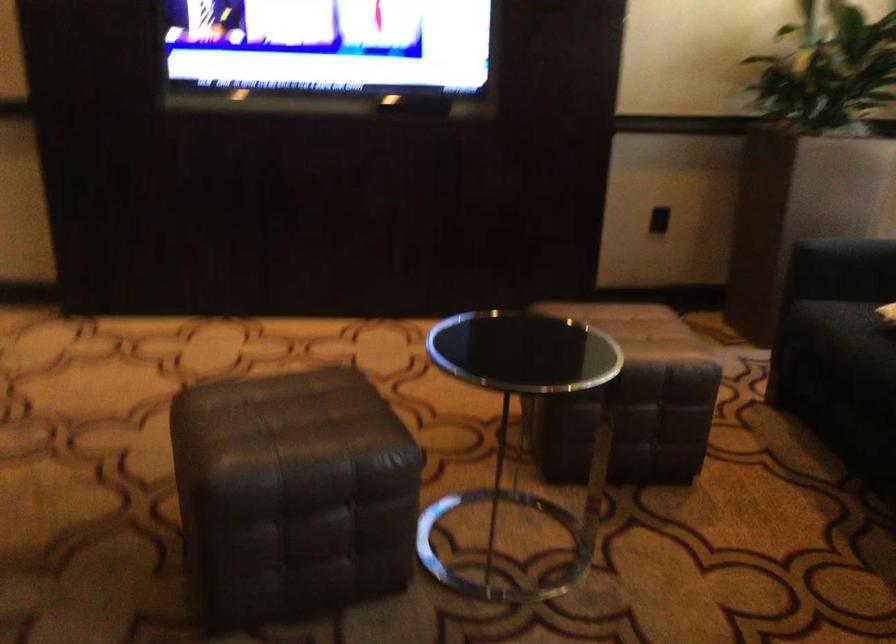
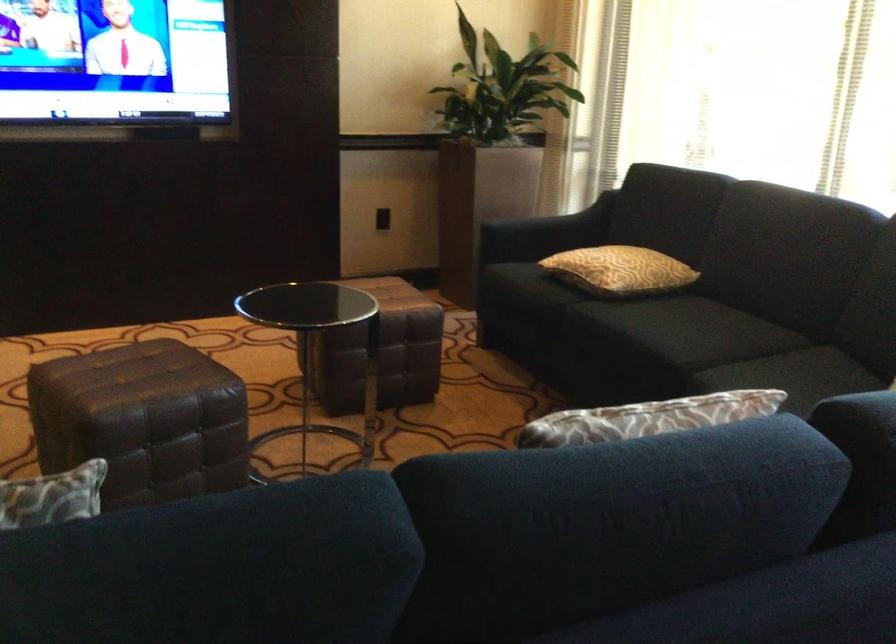
Question: The first image is from the beginning of the video and the second image is from the end. How did the camera likely rotate when shooting the video?

Choices:
 (A) Left
 (B) Right
 (C) Up
 (D) Down

Answer: (B)